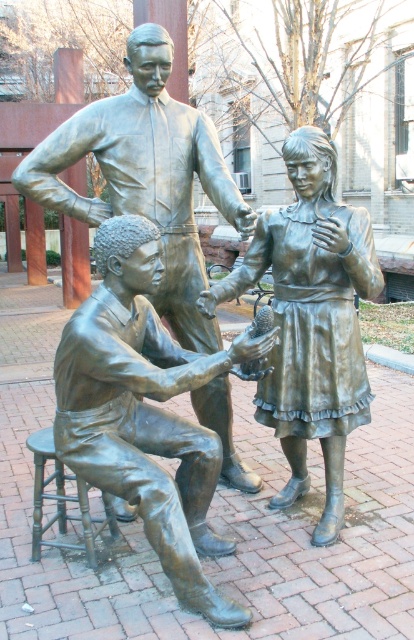
Question: Can you confirm if bronze statue at lower left is positioned above bronze statue of girl at center?

Choices:
 (A) no
 (B) yes

Answer: (A)

Question: Which of these objects is positioned farthest from the bronze statue of girl at center?

Choices:
 (A) bronze statue at lower left
 (B) bronze statue at center
 (C) bronze stool at lower left

Answer: (C)

Question: Can you confirm if bronze statue of girl at center is positioned to the right of bronze stool at lower left?

Choices:
 (A) no
 (B) yes

Answer: (B)

Question: Considering the real-world distances, which object is closest to the bronze statue of girl at center?

Choices:
 (A) bronze stool at lower left
 (B) bronze statue at lower left

Answer: (B)

Question: Does bronze statue of girl at center appear over bronze stool at lower left?

Choices:
 (A) no
 (B) yes

Answer: (B)

Question: Among these points, which one is farthest from the camera?

Choices:
 (A) (144, 525)
 (B) (233, 468)
 (C) (86, 560)
 (D) (336, 260)

Answer: (B)